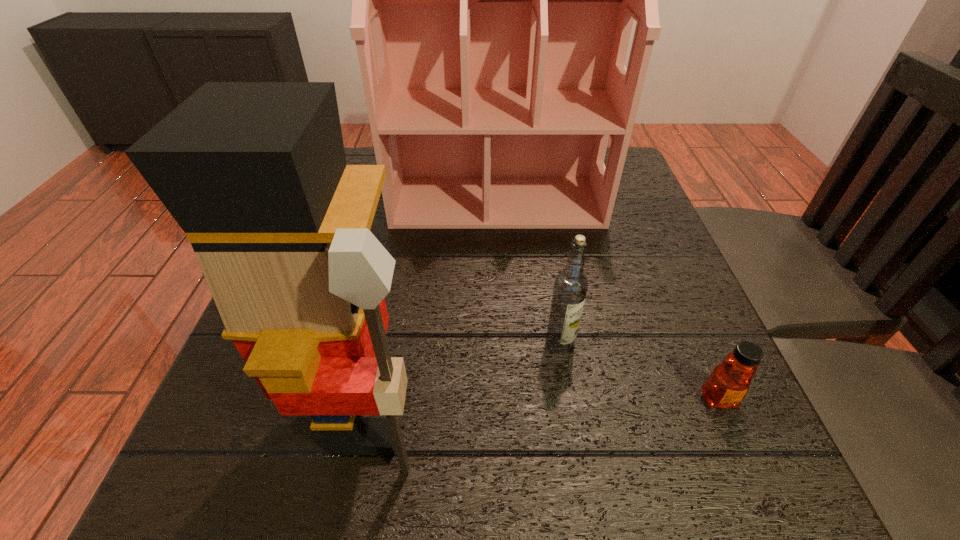
Locate an element on the screen. object at the near edge is located at coordinates (255, 174).

The width and height of the screenshot is (960, 540). Identify the location of object that is at the left edge. (255, 174).

At what (x,y) coordinates should I click in order to perform the action: click on dollhouse located in the right edge section of the desktop. Please return your answer as a coordinate pair (x, y). The height and width of the screenshot is (540, 960). Looking at the image, I should click on (493, 0).

This screenshot has width=960, height=540. In order to click on honey that is at the right edge in this screenshot , I will do `click(727, 385)`.

Locate an element on the screen. This screenshot has width=960, height=540. object present at the near left corner is located at coordinates (255, 174).

Where is `object that is at the far right corner`? object that is at the far right corner is located at coordinates (493, 0).

The height and width of the screenshot is (540, 960). Identify the location of free spot at the near edge of the desktop. (425, 485).

Identify the location of blank space at the right edge of the desktop. (623, 332).

Find the location of `vacant space at the far left corner of the desktop`. vacant space at the far left corner of the desktop is located at coordinates (364, 159).

In the image, there is a desktop. Identify the location of free space at the near right corner. (659, 500).